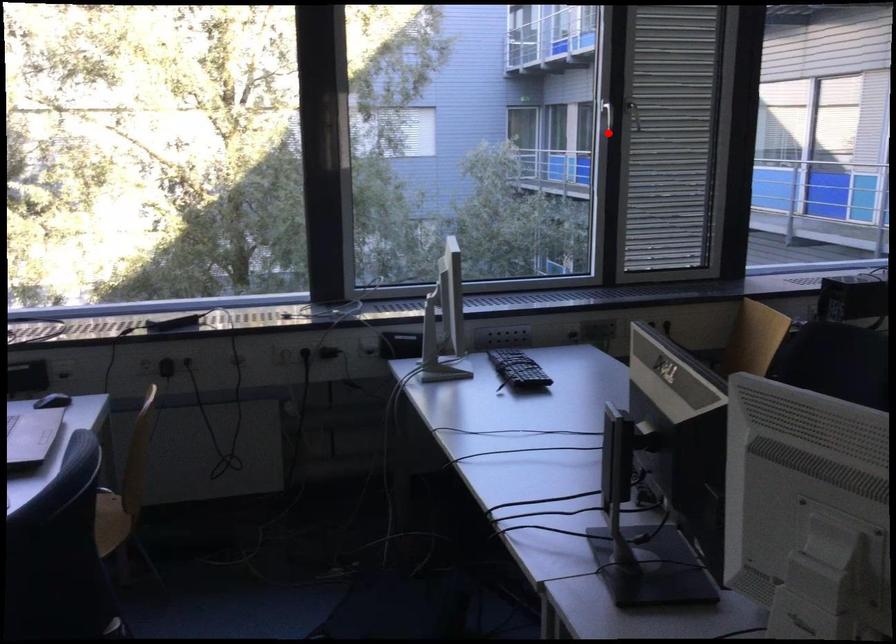
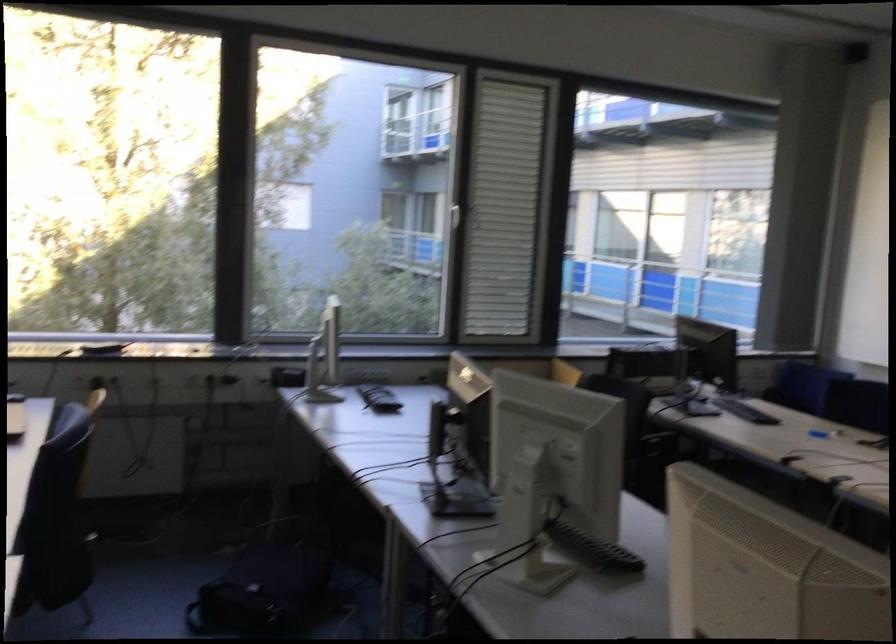
Question: I am providing you with two images of the same scene from different viewpoints. A red point is shown in image1. For the corresponding object point in image2, is it positioned nearer or farther from the camera?

Choices:
 (A) Nearer
 (B) Farther

Answer: (B)